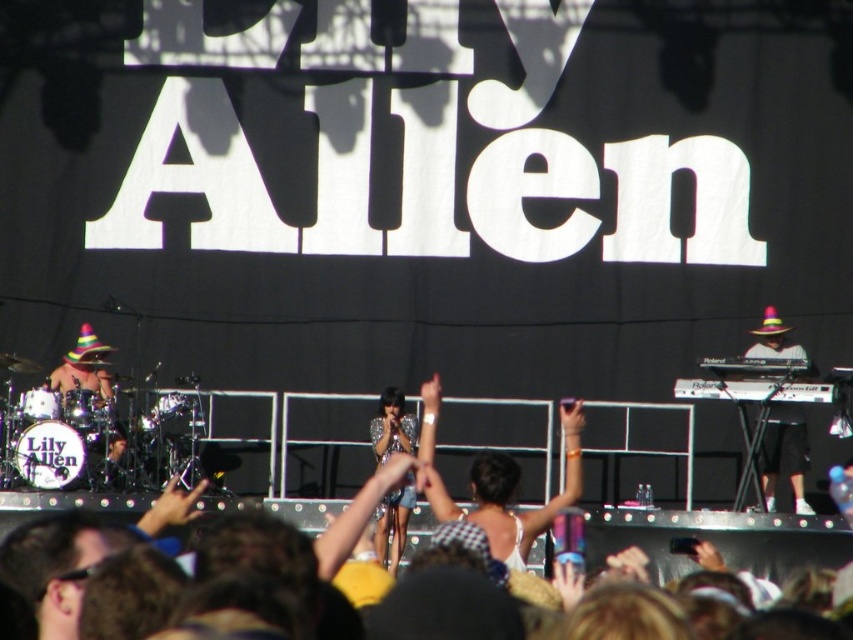
Question: Considering the relative positions of purple felt hat at right and sparkly silver dress at center in the image provided, where is purple felt hat at right located with respect to sparkly silver dress at center?

Choices:
 (A) above
 (B) below

Answer: (A)

Question: Does white fabric dress at center appear under sparkly silver dress at center?

Choices:
 (A) no
 (B) yes

Answer: (A)

Question: Which of these objects is positioned farthest from the purple felt hat at right?

Choices:
 (A) white fabric dress at center
 (B) sparkly silver dress at center

Answer: (B)

Question: Is white fabric dress at center positioned behind sparkly silver dress at center?

Choices:
 (A) yes
 (B) no

Answer: (A)

Question: Which object is positioned farthest from the sparkly silver dress at center?

Choices:
 (A) purple felt hat at right
 (B) white fabric dress at center

Answer: (A)

Question: Based on their relative distances, which object is nearer to the sparkly silver dress at center?

Choices:
 (A) white fabric dress at center
 (B) purple felt hat at right

Answer: (A)